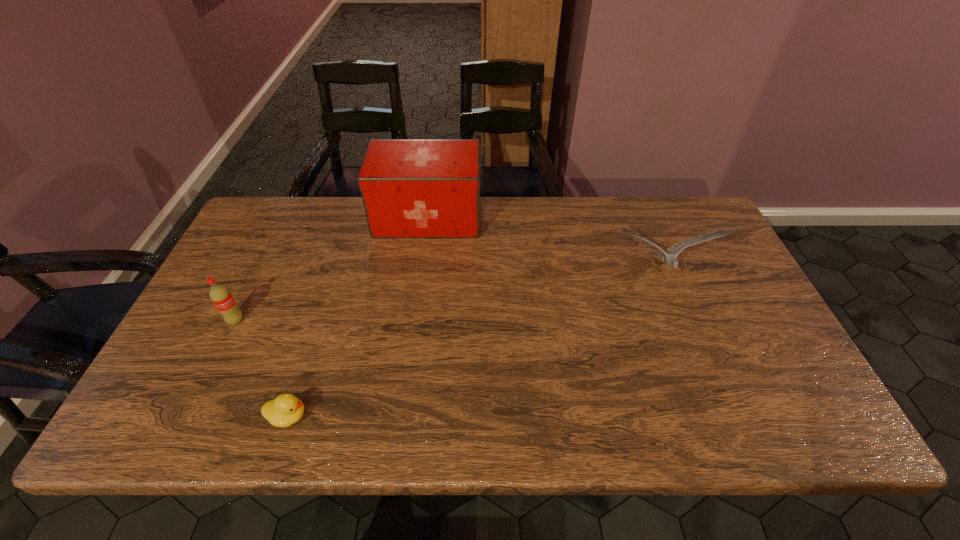
This screenshot has height=540, width=960. In the image, there is a desktop. Find the location of `free space at the far right corner`. free space at the far right corner is located at coordinates (668, 236).

Identify the location of free spot between the nearest object and the second farthest object. The image size is (960, 540). (475, 344).

This screenshot has height=540, width=960. What are the coordinates of `empty space between the first-aid kit and the gull` in the screenshot? It's located at (544, 245).

You are a GUI agent. You are given a task and a screenshot of the screen. Output one action in this format:
    pyautogui.click(x=<x>, y=<y>)
    Task: Click on the vacant area that lies between the nearest object and the rightmost object
    The height and width of the screenshot is (540, 960).
    Given the screenshot: What is the action you would take?
    click(475, 344)

The image size is (960, 540). Find the location of `empty space that is in between the leftmost object and the third object from right to left`. empty space that is in between the leftmost object and the third object from right to left is located at coordinates (262, 368).

Locate an element on the screen. vacant region between the third nearest object and the farthest object is located at coordinates (544, 245).

Identify the location of free point between the farthest object and the gull. 544,245.

Where is `vacant space that is in between the third object from right to left and the second farthest object`? The height and width of the screenshot is (540, 960). vacant space that is in between the third object from right to left and the second farthest object is located at coordinates (475, 344).

Identify the location of unoccupied area between the gull and the soda. The height and width of the screenshot is (540, 960). (448, 296).

The width and height of the screenshot is (960, 540). Find the location of `free space between the farthest object and the second farthest object`. free space between the farthest object and the second farthest object is located at coordinates (544, 245).